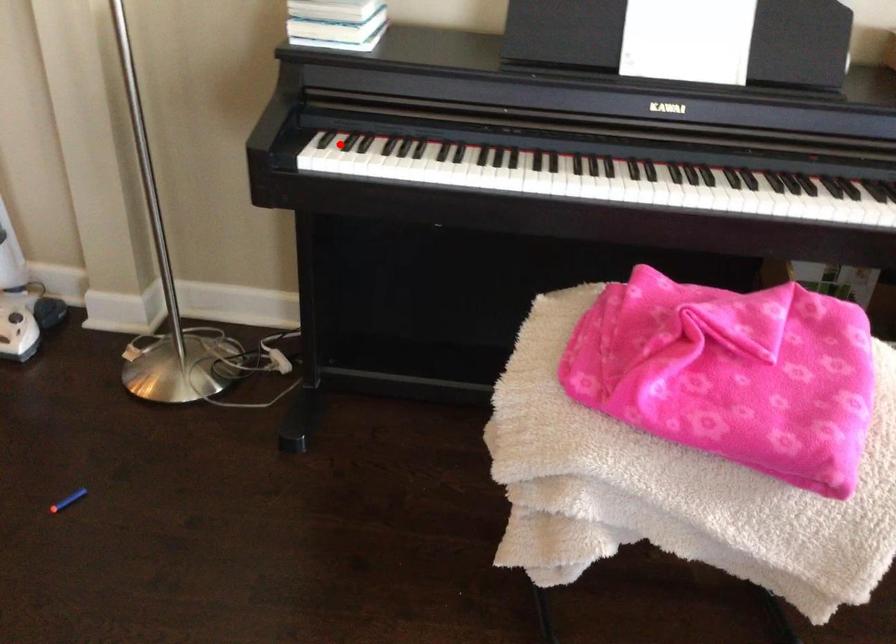
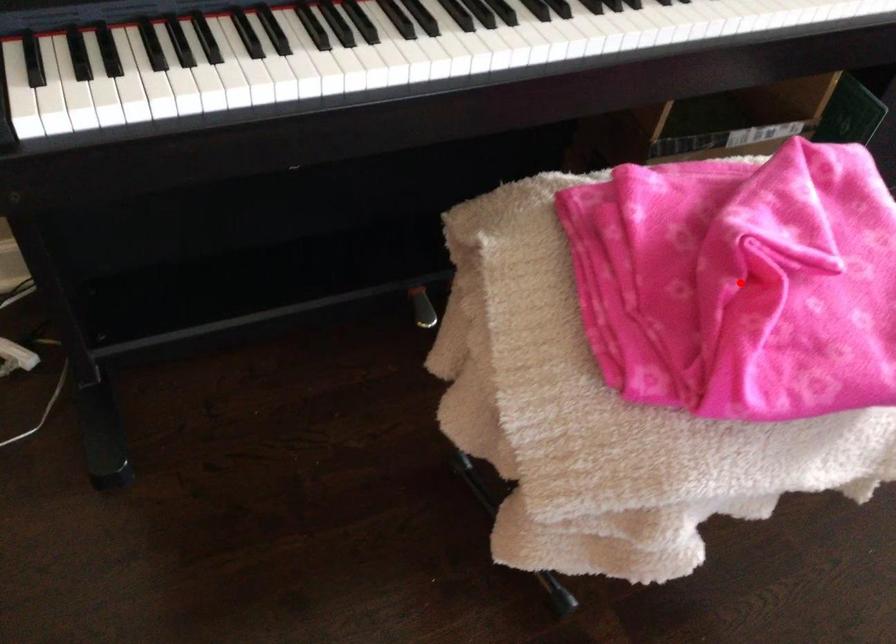
I am providing you with two images of the same scene from different viewpoints. A red point is marked on the first image and another point is marked on the second image. Is the red point in image1 aligned with the point shown in image2?

No